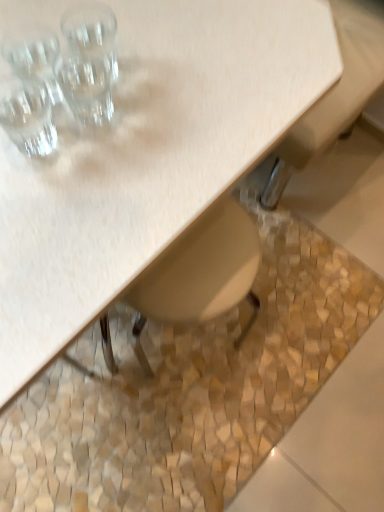
In order to click on free spot behind transparent glass at upper left, which is the 1th shot glass in top-to-bottom order in this screenshot , I will do `click(107, 24)`.